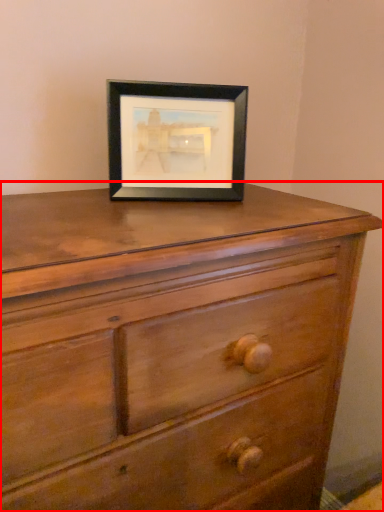
Question: From the image's perspective, what is the correct spatial relationship of chest of drawers (annotated by the red box) in relation to picture frame?

Choices:
 (A) below
 (B) above

Answer: (A)